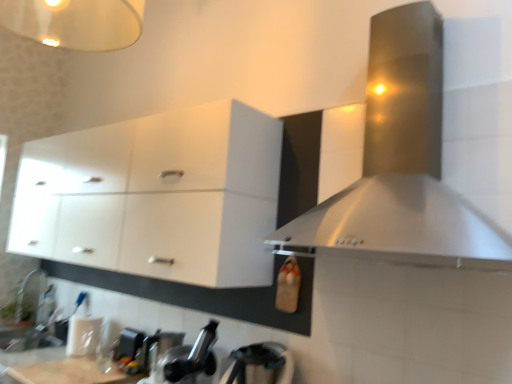
Question: Is white glossy cabinet at upper left facing away from brushed metal kettle at lower center, which is the 3th appliance from left to right?

Choices:
 (A) yes
 (B) no

Answer: (B)

Question: Can you confirm if white glossy cabinet at upper left is taller than brushed metal kettle at lower center, the first appliance from the front?

Choices:
 (A) yes
 (B) no

Answer: (A)

Question: Is the surface of white glossy cabinet at upper left in direct contact with brushed metal kettle at lower center, which is the 3th appliance from left to right?

Choices:
 (A) no
 (B) yes

Answer: (A)

Question: Is the position of white glossy cabinet at upper left more distant than that of brushed metal kettle at lower center, which is the 3th appliance from left to right?

Choices:
 (A) yes
 (B) no

Answer: (A)

Question: Can you confirm if white glossy cabinet at upper left is shorter than brushed metal kettle at lower center, arranged as the 1th appliance when viewed from the right?

Choices:
 (A) no
 (B) yes

Answer: (A)

Question: Considering the positions of brushed metal kettle at lower center, which is the 3th appliance from back to front, and white glossy sink at lower left in the image, is brushed metal kettle at lower center, which is the 3th appliance from back to front, taller or shorter than white glossy sink at lower left?

Choices:
 (A) short
 (B) tall

Answer: (A)

Question: Relative to white glossy sink at lower left, is brushed metal kettle at lower center, which is the 3th appliance from left to right, in front or behind?

Choices:
 (A) front
 (B) behind

Answer: (A)

Question: In the image, is brushed metal kettle at lower center, which is the 3th appliance from left to right, on the left side or the right side of white glossy sink at lower left?

Choices:
 (A) left
 (B) right

Answer: (B)

Question: From the image's perspective, is brushed metal kettle at lower center, which is the 3th appliance from back to front, positioned above or below white glossy sink at lower left?

Choices:
 (A) below
 (B) above

Answer: (B)

Question: Looking at their shapes, would you say brushed metal faucet at lower left is wider or thinner than stainless steel range hood at upper right?

Choices:
 (A) wide
 (B) thin

Answer: (B)

Question: From a real-world perspective, relative to stainless steel range hood at upper right, is brushed metal faucet at lower left vertically above or below?

Choices:
 (A) below
 (B) above

Answer: (A)

Question: Which is correct: brushed metal faucet at lower left is inside stainless steel range hood at upper right, or outside of it?

Choices:
 (A) inside
 (B) outside

Answer: (B)

Question: Looking at the image, does brushed metal faucet at lower left seem bigger or smaller compared to stainless steel range hood at upper right?

Choices:
 (A) big
 (B) small

Answer: (B)

Question: In the image, is black matte faucet at lower center, positioned as the second appliance in front-to-back order, positioned in front of or behind stainless steel range hood at upper right?

Choices:
 (A) behind
 (B) front

Answer: (A)

Question: Is black matte faucet at lower center, positioned as the second appliance in front-to-back order, spatially inside stainless steel range hood at upper right, or outside of it?

Choices:
 (A) inside
 (B) outside

Answer: (B)